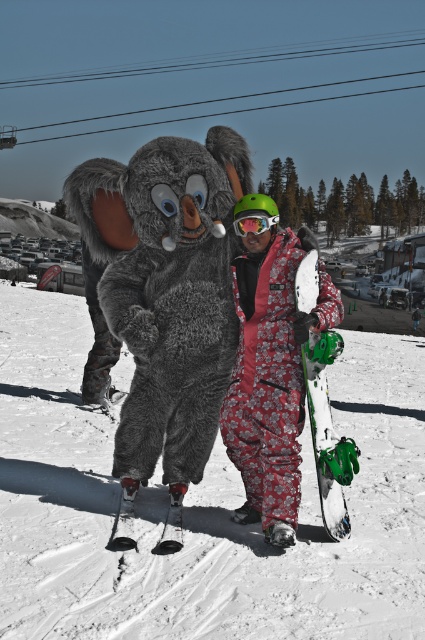
You are a photographer trying to capture a clear photo of the white matte snowboard at center without the fuzzy gray costume at center blocking it. What should you do?

The fuzzy gray costume at center is positioned over the white matte snowboard at center, so you should move the fuzzy gray costume at center or adjust your angle to avoid it blocking the snowboard.

You are a photographer trying to capture the snowboarder and mascot in a photo. The white matte snowboard at center and green matte goggles at center are both in the frame. If you want to ensure that the wider object is fully visible, which one should you focus on adjusting the camera angle for?

The white matte snowboard at center is wider than the green matte goggles at center, so you should focus on adjusting the camera angle to ensure the white matte snowboard at center is fully visible.